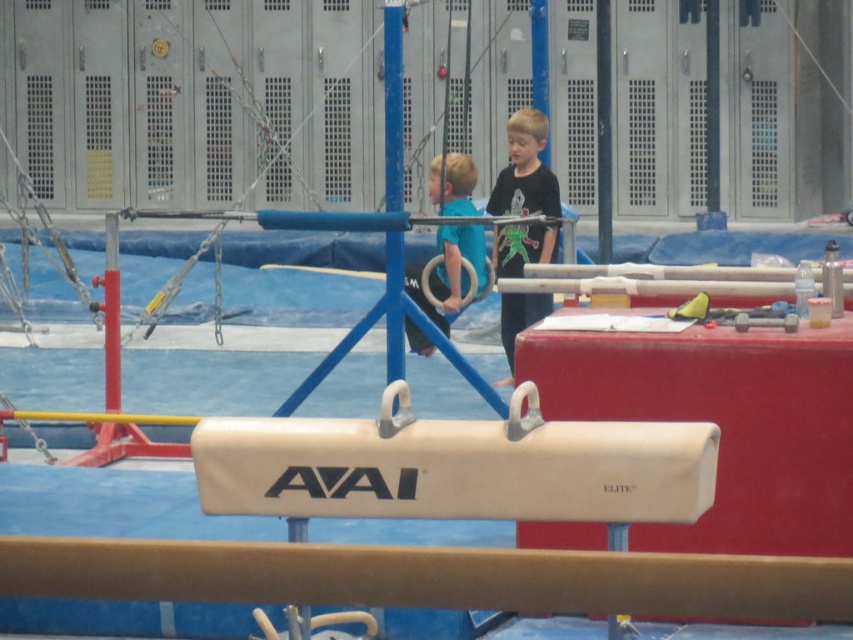
Question: Considering the real-world distances, which object is farthest from the blue matte gymnastic rings at center?

Choices:
 (A) beige rubber pommel horse at center
 (B) black matte shirt at center

Answer: (A)

Question: Which object is closer to the camera taking this photo?

Choices:
 (A) black matte shirt at center
 (B) blue metallic pole at center

Answer: (B)

Question: Based on their relative distances, which object is farther from the beige rubber pommel horse at center?

Choices:
 (A) blue metallic pole at center
 (B) blue matte gymnastic rings at center
 (C) smooth tan gymnastics beam at center

Answer: (B)

Question: Considering the relative positions of black matte shirt at center and blue matte gymnastic rings at center in the image provided, where is black matte shirt at center located with respect to blue matte gymnastic rings at center?

Choices:
 (A) above
 (B) below

Answer: (B)

Question: Is beige rubber pommel horse at center positioned before smooth tan gymnastics beam at center?

Choices:
 (A) no
 (B) yes

Answer: (A)

Question: Is blue matte gymnastic rings at center closer to the viewer compared to blue metallic pole at center?

Choices:
 (A) yes
 (B) no

Answer: (B)